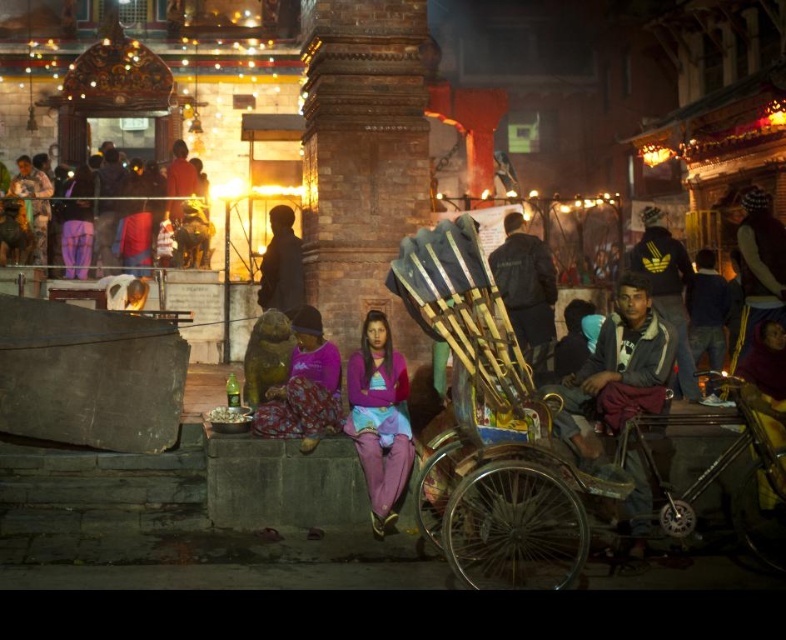
You are a photographer trying to capture the scene from the left side of the image. You want to ensure that both the dark blue adidas jacket at center and the matte black figure at center are visible in your shot. Based on their positions, which one should you adjust your camera to focus on first to include both in the frame?

The dark blue adidas jacket at center is to the right of the matte black figure at center, so you should focus on the matte black figure at center first to ensure both are within the frame when adjusting the camera.